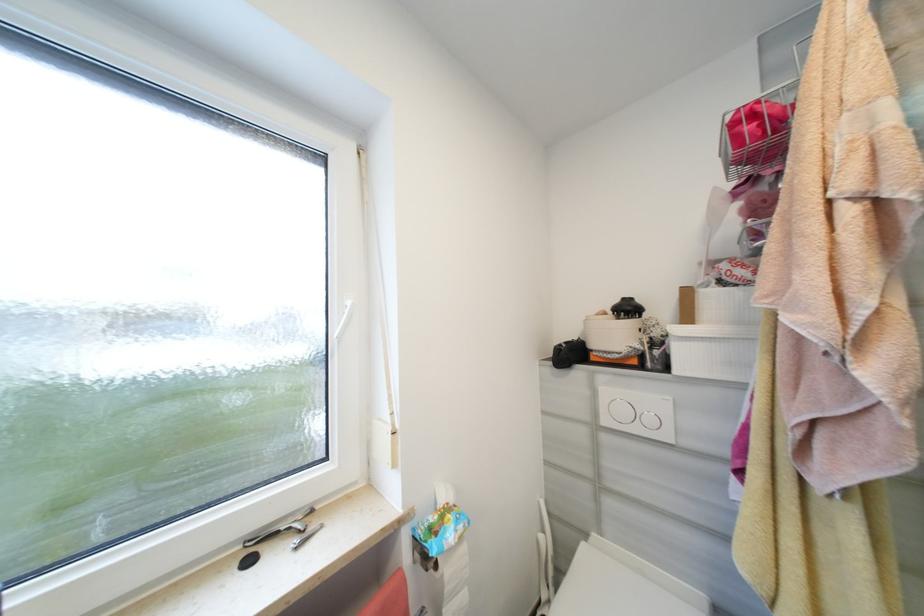
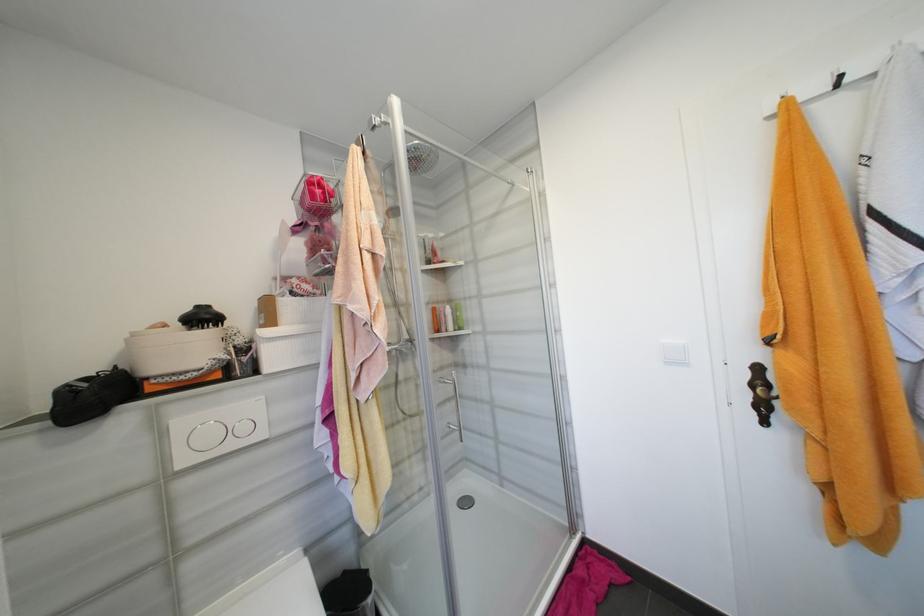
Find the pixel in the second image that matches point 669,344 in the first image.

(256, 349)